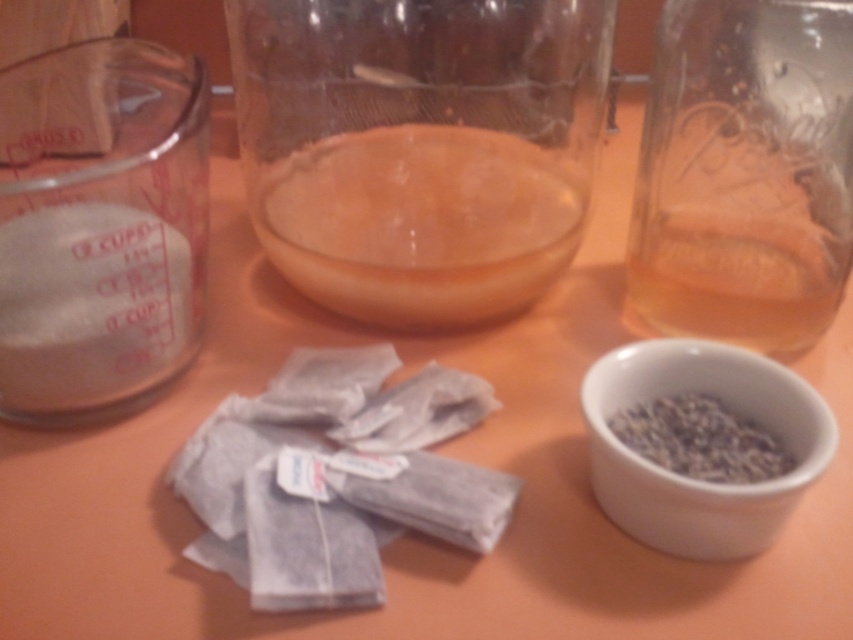
Question: Which object appears farthest from the camera in this image?

Choices:
 (A) transparent glass jar at center
 (B) white ceramic bowl at lower right

Answer: (A)

Question: Which object is closer to the camera taking this photo?

Choices:
 (A) white ceramic bowl at lower right
 (B) transparent glass jar at upper right

Answer: (A)

Question: Does transparent glass jar at center have a larger size compared to white ceramic bowl at lower right?

Choices:
 (A) no
 (B) yes

Answer: (B)

Question: From the image, what is the correct spatial relationship of transparent glass jar at center in relation to transparent glass jar at upper right?

Choices:
 (A) right
 (B) left

Answer: (B)

Question: Is transparent glass jar at center in front of white ceramic bowl at lower right?

Choices:
 (A) yes
 (B) no

Answer: (B)

Question: Among these points, which one is nearest to the camera?

Choices:
 (A) (689, 476)
 (B) (660, 369)
 (C) (279, 4)
 (D) (674, 276)

Answer: (A)